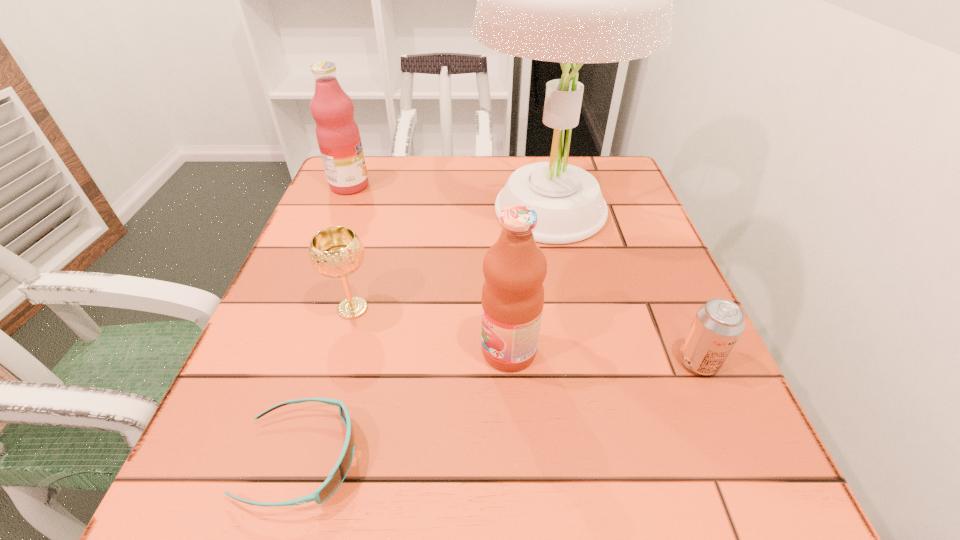
Locate an element on the screen. free spot at the right edge of the desktop is located at coordinates (639, 248).

The image size is (960, 540). In the image, there is a desktop. What are the coordinates of `vacant space at the far left corner` in the screenshot? It's located at (374, 196).

In the image, there is a desktop. Where is `vacant space at the near left corner`? The height and width of the screenshot is (540, 960). vacant space at the near left corner is located at coordinates (197, 492).

Locate an element on the screen. The height and width of the screenshot is (540, 960). free space at the far right corner of the desktop is located at coordinates (612, 167).

You are a GUI agent. You are given a task and a screenshot of the screen. Output one action in this format:
    pyautogui.click(x=<x>, y=<y>)
    Task: Click on the vacant space at the near right corner
    Image resolution: width=960 pixels, height=540 pixels.
    Given the screenshot: What is the action you would take?
    pyautogui.click(x=678, y=484)

The image size is (960, 540). What are the coordinates of `vacant point located between the tallest object and the beer can` in the screenshot? It's located at (623, 287).

Where is `free space that is in between the lamp and the left fruit juice`? The image size is (960, 540). free space that is in between the lamp and the left fruit juice is located at coordinates (448, 199).

You are a GUI agent. You are given a task and a screenshot of the screen. Output one action in this format:
    pyautogui.click(x=<x>, y=<y>)
    Task: Click on the unoccupied area between the farther fruit juice and the nearest object
    The image size is (960, 540).
    Given the screenshot: What is the action you would take?
    pyautogui.click(x=325, y=322)

Find the location of a particular element. This screenshot has width=960, height=540. vacant region between the beer can and the sunglasses is located at coordinates (499, 410).

The image size is (960, 540). I want to click on free space that is in between the sunglasses and the second shortest object, so click(499, 410).